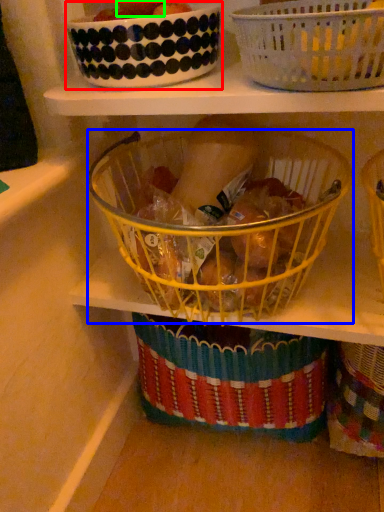
Question: Based on their relative distances, which object is farther from glass bowl (highlighted by a red box)? Choose from basket (highlighted by a blue box) and fruit (highlighted by a green box).

Choices:
 (A) basket
 (B) fruit

Answer: (A)